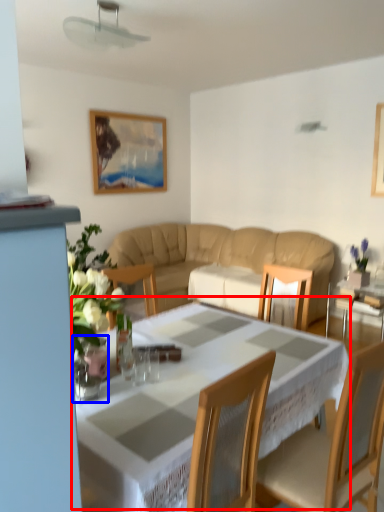
Question: Among these objects, which one is nearest to the camera, table (highlighted by a red box) or glass vase (highlighted by a blue box)?

Choices:
 (A) table
 (B) glass vase

Answer: (A)